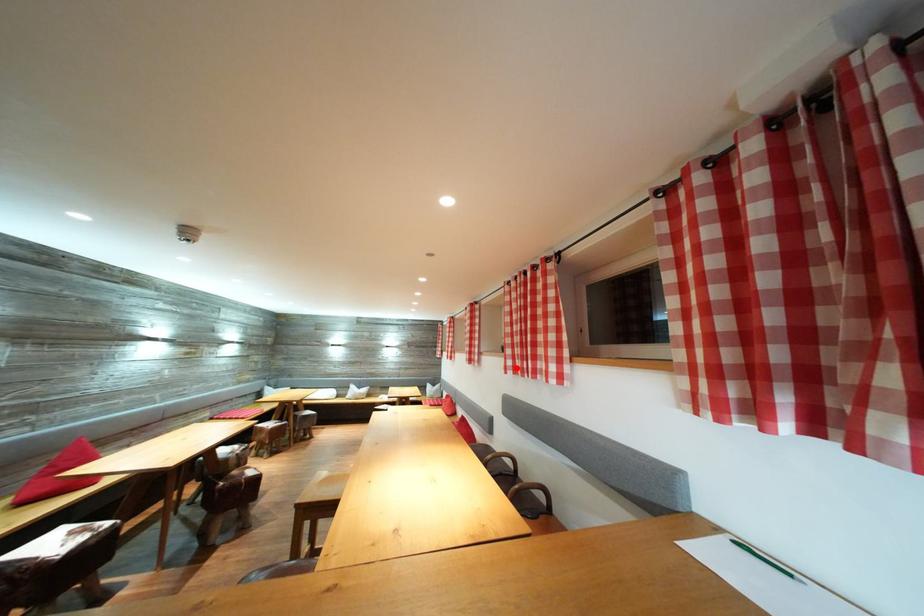
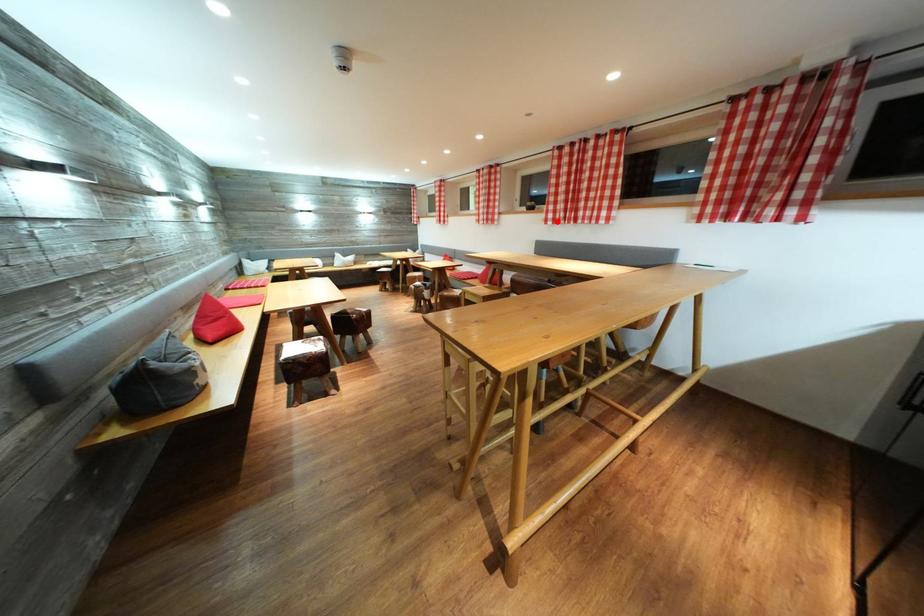
I am providing you with two images of the same scene from different viewpoints. A red point is marked on the first image and another point is marked on the second image. Are the points marked in image1 and image2 representing the same 3D position?

Yes